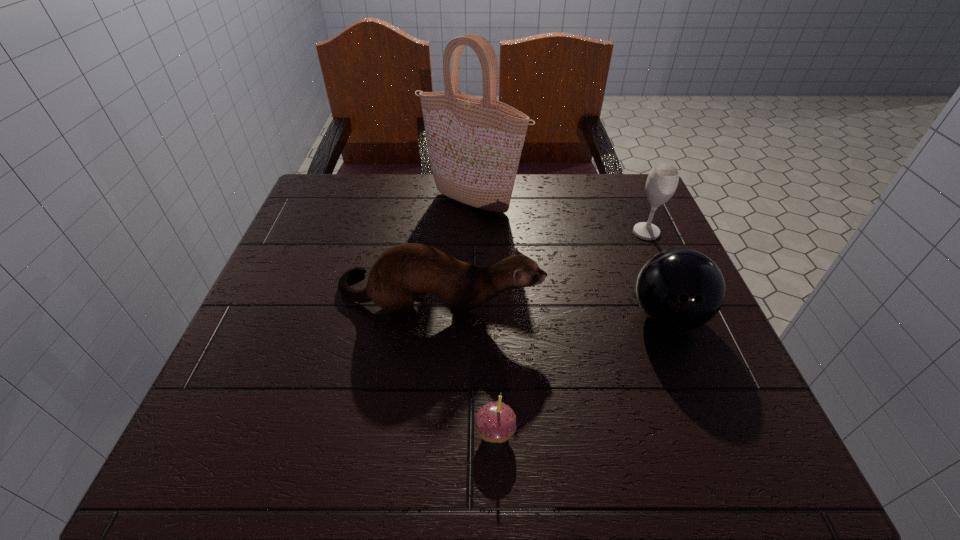
The height and width of the screenshot is (540, 960). I want to click on vacant space at the near edge, so click(x=580, y=443).

You are a GUI agent. You are given a task and a screenshot of the screen. Output one action in this format:
    pyautogui.click(x=<x>, y=<y>)
    Task: Click on the vacant space at the left edge of the desktop
    
    Given the screenshot: What is the action you would take?
    pyautogui.click(x=317, y=281)

Locate an element on the screen. This screenshot has height=540, width=960. free region at the near left corner of the desktop is located at coordinates pyautogui.click(x=249, y=428).

Identify the location of vacant position at the far right corner of the desktop. (607, 195).

In the image, there is a desktop. Where is `vacant space at the near right corner`? The height and width of the screenshot is (540, 960). vacant space at the near right corner is located at coordinates (690, 423).

This screenshot has height=540, width=960. I want to click on free space between the shopping bag and the shortest object, so click(484, 318).

Find the location of a particular element. The image size is (960, 540). unoccupied area between the farthest object and the ferret is located at coordinates (455, 251).

You are a GUI agent. You are given a task and a screenshot of the screen. Output one action in this format:
    pyautogui.click(x=<x>, y=<y>)
    Task: Click on the empty location between the ferret and the cupcake
    The height and width of the screenshot is (540, 960).
    Given the screenshot: What is the action you would take?
    pyautogui.click(x=467, y=366)

Identify the location of free space between the bowling ball and the shortest object. (581, 374).

At what (x,y) coordinates should I click in order to perform the action: click on vacant space in between the second farthest object and the tallest object. Please return your answer as a coordinate pair (x, y). The height and width of the screenshot is (540, 960). Looking at the image, I should click on [560, 218].